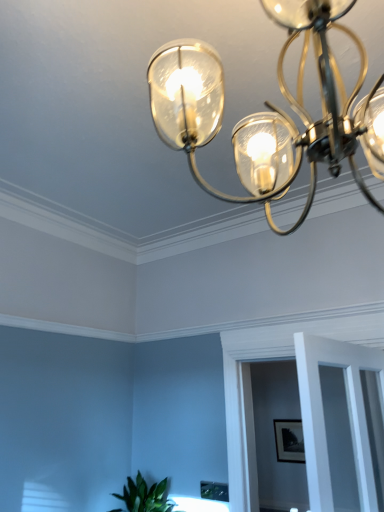
Question: Is clear glass door at center closer to camera compared to clear glass chandelier at upper center?

Choices:
 (A) no
 (B) yes

Answer: (A)

Question: Does clear glass door at center have a lesser height compared to clear glass chandelier at upper center?

Choices:
 (A) yes
 (B) no

Answer: (A)

Question: From a real-world perspective, is clear glass door at center located beneath clear glass chandelier at upper center?

Choices:
 (A) no
 (B) yes

Answer: (B)

Question: From the image's perspective, would you say clear glass door at center is shown under clear glass chandelier at upper center?

Choices:
 (A) yes
 (B) no

Answer: (A)

Question: Can you confirm if clear glass door at center is smaller than clear glass chandelier at upper center?

Choices:
 (A) yes
 (B) no

Answer: (A)

Question: Considering the positions of matte black picture frame at center and clear glass chandelier at upper center in the image, is matte black picture frame at center bigger or smaller than clear glass chandelier at upper center?

Choices:
 (A) big
 (B) small

Answer: (B)

Question: Considering the positions of matte black picture frame at center and clear glass chandelier at upper center in the image, is matte black picture frame at center taller or shorter than clear glass chandelier at upper center?

Choices:
 (A) tall
 (B) short

Answer: (B)

Question: Is point (274, 435) positioned closer to the camera than point (148, 80)?

Choices:
 (A) farther
 (B) closer

Answer: (A)

Question: Considering their positions, is matte black picture frame at center located in front of or behind clear glass chandelier at upper center?

Choices:
 (A) front
 (B) behind

Answer: (B)

Question: From the image's perspective, relative to matte black picture frame at center, is clear glass door at center above or below?

Choices:
 (A) above
 (B) below

Answer: (A)

Question: In terms of height, does clear glass door at center look taller or shorter compared to matte black picture frame at center?

Choices:
 (A) tall
 (B) short

Answer: (A)

Question: Is clear glass door at center bigger or smaller than matte black picture frame at center?

Choices:
 (A) big
 (B) small

Answer: (A)

Question: Is point (326, 344) positioned closer to the camera than point (288, 442)?

Choices:
 (A) farther
 (B) closer

Answer: (B)

Question: From the image's perspective, is matte black picture frame at center positioned above or below clear glass door at center?

Choices:
 (A) below
 (B) above

Answer: (A)

Question: Is point (299, 429) positioned closer to the camera than point (375, 349)?

Choices:
 (A) closer
 (B) farther

Answer: (B)